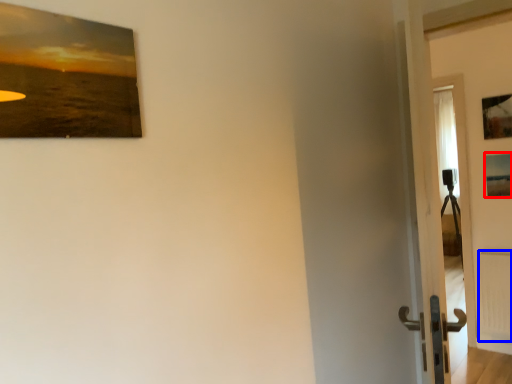
Question: Which of the following is the closest to the observer, picture frame (highlighted by a red box) or radiator (highlighted by a blue box)?

Choices:
 (A) picture frame
 (B) radiator

Answer: (A)